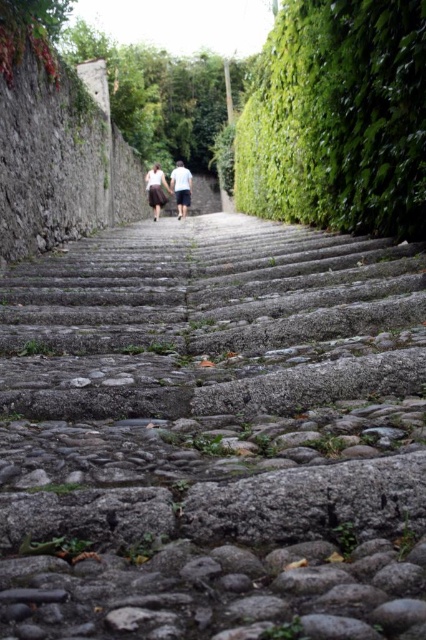
Between green leafy hedge at right and white cotton shirt at center, which one has less height?

With less height is white cotton shirt at center.

Who is more distant from viewer, (290, 58) or (187, 182)?

Point (187, 182)

Where is `green leafy hedge at right`? green leafy hedge at right is located at coordinates (339, 118).

How far apart are white cotton shirts at center and white cotton shirt at center?

The distance of white cotton shirts at center from white cotton shirt at center is 7.16 inches.

Is white cotton shirts at center positioned at the back of white cotton shirt at center?

No, white cotton shirts at center is in front of white cotton shirt at center.

Is point (181, 182) behind point (189, 180)?

That is True.

I want to click on white cotton shirts at center, so click(169, 188).

Between gray stone stairs at center and white cotton shirts at center, which one is positioned higher?

white cotton shirts at center is higher up.

Between point (32, 508) and point (184, 205), which one is positioned in front?

Point (32, 508)

The image size is (426, 640). Identify the location of gray stone stairs at center. (213, 435).